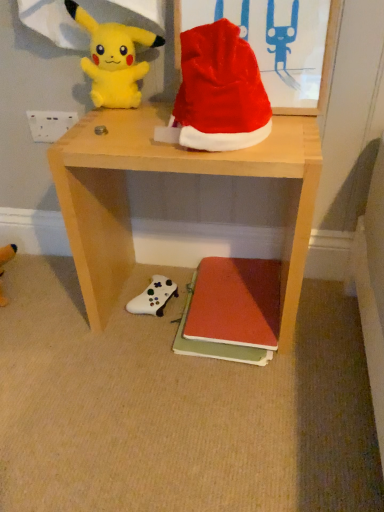
At what (x,y) coordinates should I click in order to perform the action: click on free point to the right of matte red book at lower center. Please return your answer as a coordinate pair (x, y). The height and width of the screenshot is (512, 384). Looking at the image, I should click on (324, 317).